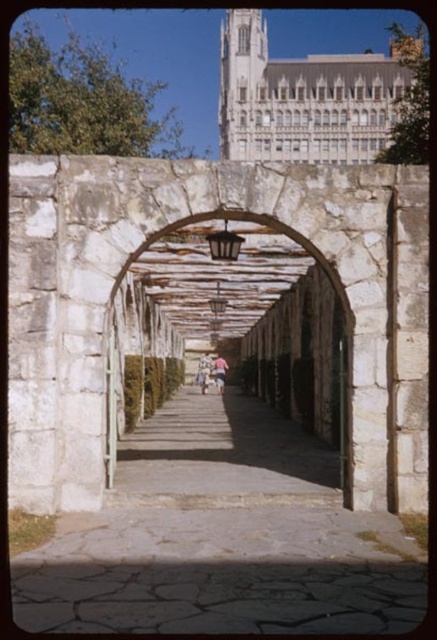
You are planning to install a new pathway light between the white wooden pergola at upper center and the light brown fabric person at center. The recommended distance between pathway lights is 50 feet. How many pathway lights do you need to install between them?

The distance between the white wooden pergola at upper center and the light brown fabric person at center is 560.32 feet. Dividing this distance by the recommended 50 feet spacing gives approximately 11.2064. Since you can only install whole lights, you would need 12 pathway lights to cover the entire distance.

You are standing at the entrance of the garden and notice the white wooden pergola at upper center. Based on its position, can you determine if it is directly above the stone archway?

The white wooden pergola at upper center is located at point coordinates that are not provided in the scene description. However, according to the spatial details, the pergola is positioned above the archway, so yes, it is directly above the stone archway.

You are standing at the entrance of the garden and see the paved stone path at center and the light brown fabric person at center. Which object is closer to you?

The paved stone path at center is closer to you because it is in front of the light brown fabric person at center.